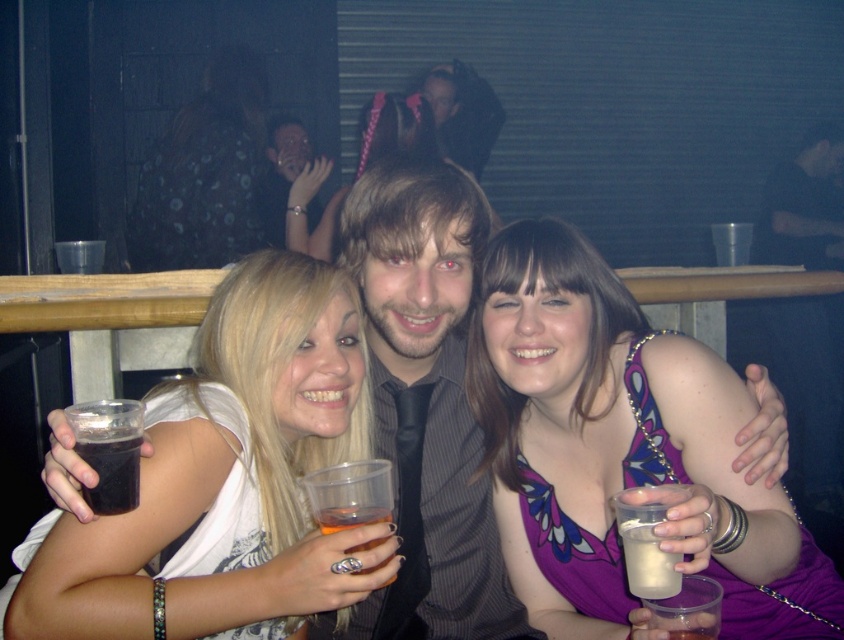
Question: Which point is farther from the camera taking this photo?

Choices:
 (A) (680, 369)
 (B) (253, 220)
 (C) (336, 525)

Answer: (B)

Question: Which of the following is the farthest from the observer?

Choices:
 (A) (160, 170)
 (B) (338, 554)

Answer: (A)

Question: Does matte plastic cup at center appear over translucent plastic cup at center?

Choices:
 (A) yes
 (B) no

Answer: (A)

Question: Among these objects, which one is farthest from the camera?

Choices:
 (A) translucent plastic cup at center
 (B) purple floral dress at center
 (C) milky white liquid at lower right

Answer: (A)

Question: In this image, where is matte plastic cup at center located relative to matte black shirt at center?

Choices:
 (A) right
 (B) left

Answer: (B)

Question: Does matte black shirt at center appear on the right side of milky white liquid at lower right?

Choices:
 (A) no
 (B) yes

Answer: (A)